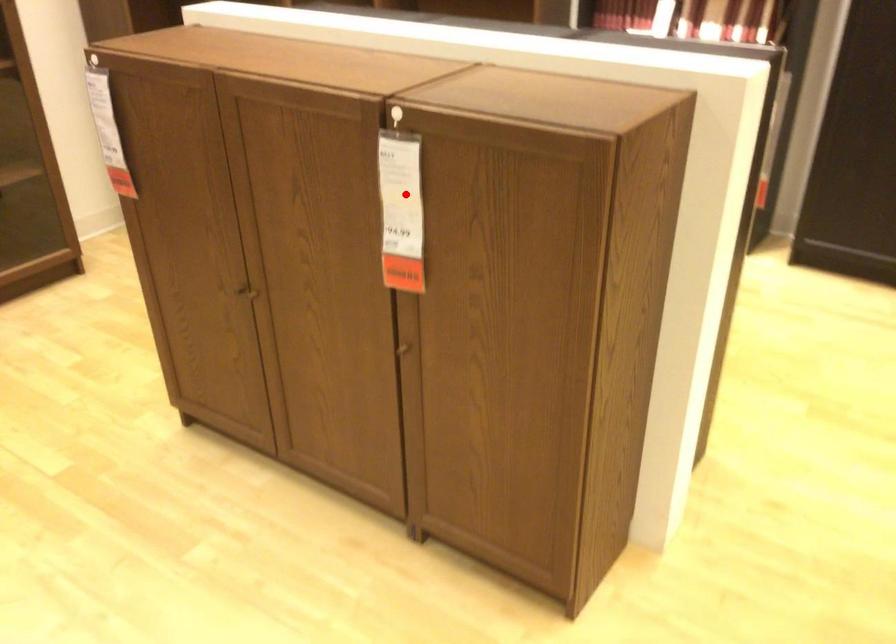
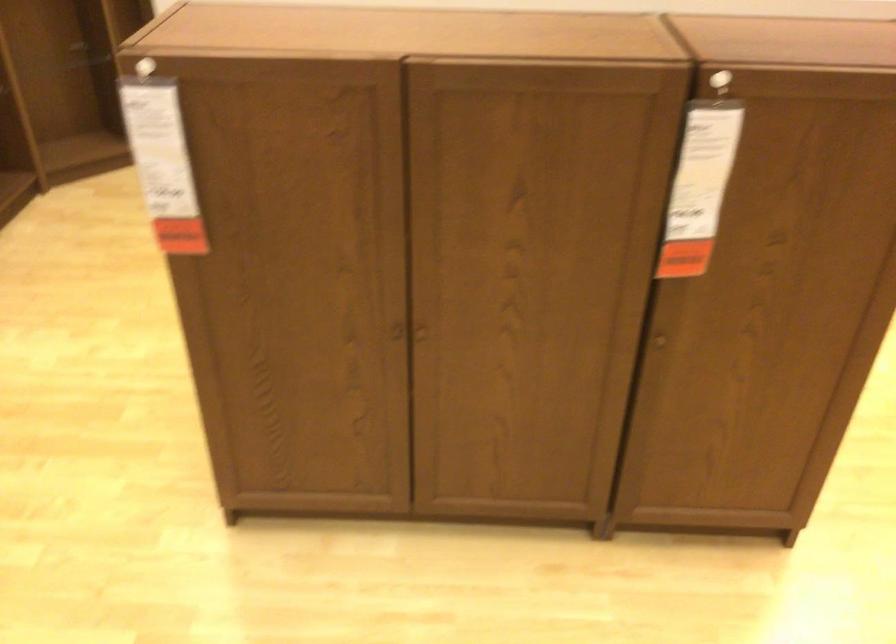
In the second image, find the point that corresponds to the highlighted location in the first image.

(702, 169)